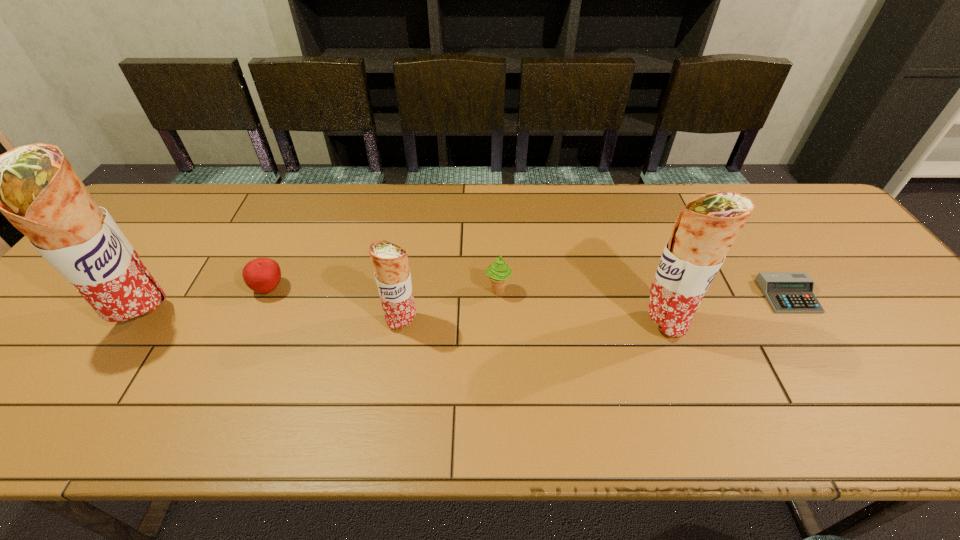
Image resolution: width=960 pixels, height=540 pixels. What are the coordinates of `the leftmost burrito` in the screenshot? It's located at (34, 186).

You are a GUI agent. You are given a task and a screenshot of the screen. Output one action in this format:
    pyautogui.click(x=<x>, y=<y>)
    Task: Click on the second burrito from left to right
    The image size is (960, 540).
    Given the screenshot: What is the action you would take?
    pyautogui.click(x=390, y=261)

Find the location of a particular element. The image size is (960, 540). the fourth object from right to left is located at coordinates (390, 261).

Identify the location of the rightmost burrito. This screenshot has height=540, width=960. (705, 229).

At what (x,y) coordinates should I click in order to perform the action: click on the second shortest burrito. Please return your answer as a coordinate pair (x, y). This screenshot has height=540, width=960. Looking at the image, I should click on (705, 229).

Locate an element on the screen. apple is located at coordinates (263, 275).

The width and height of the screenshot is (960, 540). I want to click on the second object from left to right, so click(263, 275).

Where is `the rightmost object`? The image size is (960, 540). the rightmost object is located at coordinates coord(787,292).

This screenshot has height=540, width=960. Identify the location of calculator. (787, 292).

Where is `the fourth tallest object`? the fourth tallest object is located at coordinates (498, 272).